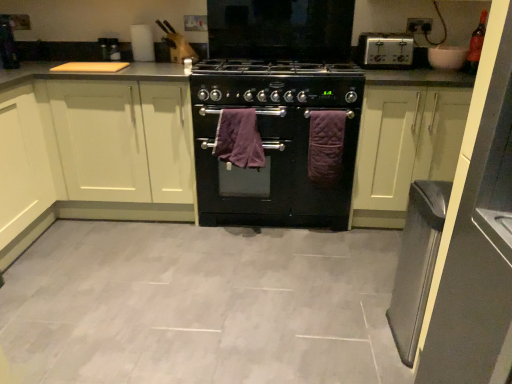
Locate an element on the screen. The width and height of the screenshot is (512, 384). purple quilted towel at center, the 2th bath towel from the left is located at coordinates (326, 146).

In order to click on purple quilted bath towel at center, the first bath towel from the left in this screenshot , I will do `click(239, 139)`.

At what (x,y) coordinates should I click in order to perform the action: click on black matte gas stove at center. Please return your answer as a coordinate pair (x, y). Looking at the image, I should click on (276, 83).

Where is `black matte oven at center`? This screenshot has width=512, height=384. black matte oven at center is located at coordinates (272, 174).

Describe the element at coordinates (272, 174) in the screenshot. I see `black matte oven at center` at that location.

The width and height of the screenshot is (512, 384). I want to click on purple quilted towel at center, the first bath towel when ordered from right to left, so click(326, 146).

Is silver metallic toaster at upper right beside white matte cabinet at left, the 2th cabinetry viewed from the right?

silver metallic toaster at upper right and white matte cabinet at left, the 2th cabinetry viewed from the right, are clearly separated.

Is point (396, 33) closer or farther from the camera than point (74, 163)?

Point (396, 33) is farther from the camera than point (74, 163).

Is silver metallic toaster at upper right in front of or behind white matte cabinet at left, the 2th cabinetry viewed from the right, in the image?

silver metallic toaster at upper right is behind white matte cabinet at left, the 2th cabinetry viewed from the right.

I want to click on gas stove on the right of white matte cabinet at left, the 2th cabinetry viewed from the right, so click(x=276, y=83).

Which point is more forward, (85, 190) or (287, 81)?

Positioned in front is point (287, 81).

Does white matte cabinet at left, marked as the 1th cabinetry in a left-to-right arrangement, contain black matte gas stove at center?

No, black matte gas stove at center is not surrounded by white matte cabinet at left, marked as the 1th cabinetry in a left-to-right arrangement.

Considering the sizes of objects white matte cabinet at left, marked as the 1th cabinetry in a left-to-right arrangement, and black matte gas stove at center in the image provided, who is smaller, white matte cabinet at left, marked as the 1th cabinetry in a left-to-right arrangement, or black matte gas stove at center?

With smaller size is black matte gas stove at center.

Between point (170, 106) and point (239, 133), which one is positioned in front?

The point (239, 133) is closer to the camera.

Considering the sizes of objects white matte cabinet at left, marked as the 1th cabinetry in a left-to-right arrangement, and purple quilted bath towel at center, the 2th bath towel positioned from the right, in the image provided, who is smaller, white matte cabinet at left, marked as the 1th cabinetry in a left-to-right arrangement, or purple quilted bath towel at center, the 2th bath towel positioned from the right,?

purple quilted bath towel at center, the 2th bath towel positioned from the right, is smaller.

Starting from the white matte cabinet at left, the 2th cabinetry viewed from the right, which bath towel is the 1st one to the right? Please provide its 2D coordinates.

[(239, 139)]

Would you say white matte cabinet at left, the 2th cabinetry viewed from the right, is outside purple quilted bath towel at center, the first bath towel from the left?

Yes.

From a real-world perspective, is black matte gas stove at center under white matte cabinet at left, the 2th cabinetry viewed from the right?

No, from a real-world perspective, black matte gas stove at center is not beneath white matte cabinet at left, the 2th cabinetry viewed from the right.

Can you see black matte gas stove at center touching white matte cabinet at left, the 2th cabinetry viewed from the right?

They are not placed beside each other.

Which object is thinner, black matte gas stove at center or white matte cabinet at left, the 2th cabinetry viewed from the right?

Thinner between the two is black matte gas stove at center.

Is the surface of white matte cabinet at center, the 2th cabinetry in the left-to-right sequence, in direct contact with silver metallic toaster at upper right?

white matte cabinet at center, the 2th cabinetry in the left-to-right sequence, is not next to silver metallic toaster at upper right, and they're not touching.

Considering the relative sizes of white matte cabinet at center, which appears as the first cabinetry when viewed from the right, and silver metallic toaster at upper right in the image provided, is white matte cabinet at center, which appears as the first cabinetry when viewed from the right, smaller than silver metallic toaster at upper right?

No.

Is white matte cabinet at center, the 2th cabinetry in the left-to-right sequence, positioned before silver metallic toaster at upper right?

Yes, white matte cabinet at center, the 2th cabinetry in the left-to-right sequence, is closer to the camera.

From the image's perspective, is white matte cabinet at center, the 2th cabinetry in the left-to-right sequence, positioned above or below silver metallic toaster at upper right?

Based on their image positions, white matte cabinet at center, the 2th cabinetry in the left-to-right sequence, is located beneath silver metallic toaster at upper right.

Is purple quilted towel at center, the 2th bath towel from the left, facing away from white matte cabinet at left, marked as the 1th cabinetry in a left-to-right arrangement?

No, purple quilted towel at center, the 2th bath towel from the left, is not facing away from white matte cabinet at left, marked as the 1th cabinetry in a left-to-right arrangement.

Is purple quilted towel at center, the first bath towel when ordered from right to left, at the left side of white matte cabinet at left, the 2th cabinetry viewed from the right?

No.

Is point (320, 139) positioned in front of point (106, 84)?

That is True.

This screenshot has width=512, height=384. I want to click on cabinetry behind the purple quilted towel at center, the 2th bath towel from the left, so click(x=105, y=144).

Consider the image. Which object is further away from the camera taking this photo, silver metallic toaster at upper right or purple quilted bath towel at center, the first bath towel from the left?

silver metallic toaster at upper right is more distant.

Is silver metallic toaster at upper right facing towards purple quilted bath towel at center, the first bath towel from the left?

No, silver metallic toaster at upper right is not aimed at purple quilted bath towel at center, the first bath towel from the left.

Where is `home appliance that is behind the purple quilted bath towel at center, the first bath towel from the left`? Image resolution: width=512 pixels, height=384 pixels. home appliance that is behind the purple quilted bath towel at center, the first bath towel from the left is located at coordinates (385, 50).

You are a GUI agent. You are given a task and a screenshot of the screen. Output one action in this format:
    pyautogui.click(x=<x>, y=<y>)
    Task: Click on the cabinetry that is the 1st one when counting downward from the silver metallic toaster at upper right (from the image's perspective)
    Image resolution: width=512 pixels, height=384 pixels.
    Given the screenshot: What is the action you would take?
    pyautogui.click(x=105, y=144)

This screenshot has height=384, width=512. In order to click on cabinetry that is the 1st object directly below the black matte gas stove at center (from a real-world perspective) in this screenshot , I will do `click(105, 144)`.

Estimate the real-world distances between objects in this image. Which object is closer to black matte oven at center, white matte cabinet at left, marked as the 1th cabinetry in a left-to-right arrangement, or purple quilted towel at center, the 2th bath towel from the left?

Based on the image, purple quilted towel at center, the 2th bath towel from the left, appears to be nearer to black matte oven at center.

Looking at the image, which one is located further to white matte cabinet at left, the 2th cabinetry viewed from the right, black matte gas stove at center or white matte cabinet at center, the 2th cabinetry in the left-to-right sequence?

white matte cabinet at center, the 2th cabinetry in the left-to-right sequence, is further to white matte cabinet at left, the 2th cabinetry viewed from the right.

Looking at the image, which one is located closer to black matte oven at center, purple quilted towel at center, the first bath towel when ordered from right to left, or black matte gas stove at center?

Based on the image, purple quilted towel at center, the first bath towel when ordered from right to left, appears to be nearer to black matte oven at center.

From the image, which object appears to be nearer to white matte cabinet at left, marked as the 1th cabinetry in a left-to-right arrangement, white matte cabinet at center, the 2th cabinetry in the left-to-right sequence, or black matte gas stove at center?

black matte gas stove at center.

From the image, which object appears to be nearer to purple quilted towel at center, the first bath towel when ordered from right to left, black matte oven at center or white matte cabinet at left, marked as the 1th cabinetry in a left-to-right arrangement?

The object closer to purple quilted towel at center, the first bath towel when ordered from right to left, is black matte oven at center.

When comparing their distances from white matte cabinet at left, the 2th cabinetry viewed from the right, does black matte gas stove at center or silver metallic toaster at upper right seem closer?

Based on the image, black matte gas stove at center appears to be nearer to white matte cabinet at left, the 2th cabinetry viewed from the right.

Based on their spatial positions, is purple quilted towel at center, the 2th bath towel from the left, or black matte gas stove at center further from white matte cabinet at left, the 2th cabinetry viewed from the right?

purple quilted towel at center, the 2th bath towel from the left, is further to white matte cabinet at left, the 2th cabinetry viewed from the right.

Considering their positions, is black matte gas stove at center positioned further to purple quilted towel at center, the 2th bath towel from the left, than black matte oven at center?

The object further to purple quilted towel at center, the 2th bath towel from the left, is black matte gas stove at center.

This screenshot has height=384, width=512. What are the coordinates of `oven between purple quilted bath towel at center, the first bath towel from the left, and white matte cabinet at center, which appears as the first cabinetry when viewed from the right, in the horizontal direction` in the screenshot? It's located at (272, 174).

This screenshot has width=512, height=384. Find the location of `gas stove between black matte oven at center and silver metallic toaster at upper right from left to right`. gas stove between black matte oven at center and silver metallic toaster at upper right from left to right is located at coordinates (276, 83).

Locate an element on the screen. Image resolution: width=512 pixels, height=384 pixels. bath towel between white matte cabinet at left, marked as the 1th cabinetry in a left-to-right arrangement, and purple quilted towel at center, the first bath towel when ordered from right to left, in the horizontal direction is located at coordinates (239, 139).

The width and height of the screenshot is (512, 384). In order to click on oven between white matte cabinet at left, the 2th cabinetry viewed from the right, and purple quilted towel at center, the 2th bath towel from the left in this screenshot , I will do `click(272, 174)`.